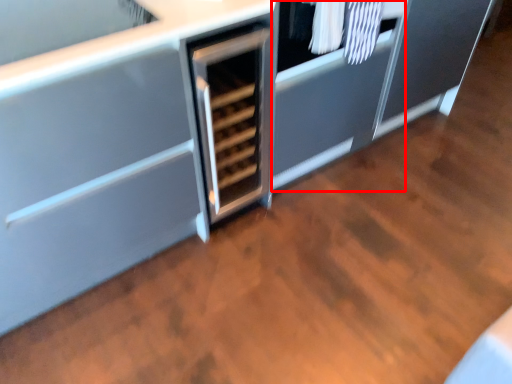
Question: From the image, what is the correct spatial relationship of cabinetry (annotated by the red box) in relation to laundry?

Choices:
 (A) right
 (B) left

Answer: (B)